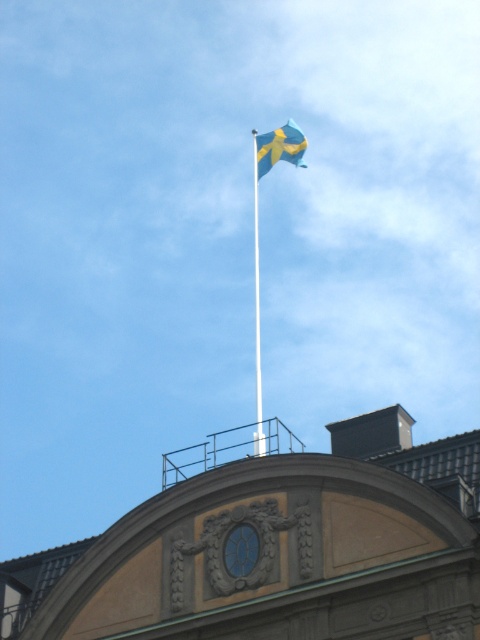
Does blue fabric flag at upper center have a smaller size compared to white smooth flag pole at upper center?

Correct, blue fabric flag at upper center occupies less space than white smooth flag pole at upper center.

Does blue fabric flag at upper center lie behind white smooth flag pole at upper center?

That is True.

Is point (300, 157) less distant than point (254, 273)?

Yes, it is in front of point (254, 273).

Where is `blue fabric flag at upper center`? The width and height of the screenshot is (480, 640). blue fabric flag at upper center is located at coordinates (279, 147).